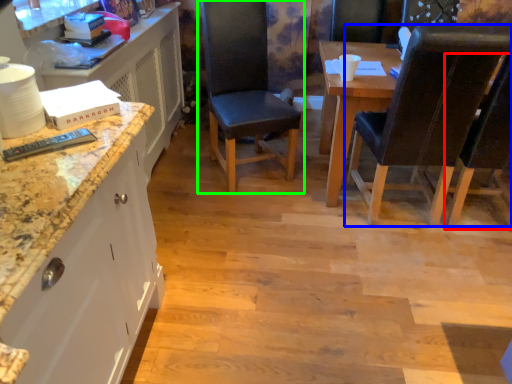
Question: Considering the real-world distances, which object is farthest from chair (highlighted by a red box)? chair (highlighted by a blue box) or chair (highlighted by a green box)?

Choices:
 (A) chair
 (B) chair

Answer: (B)